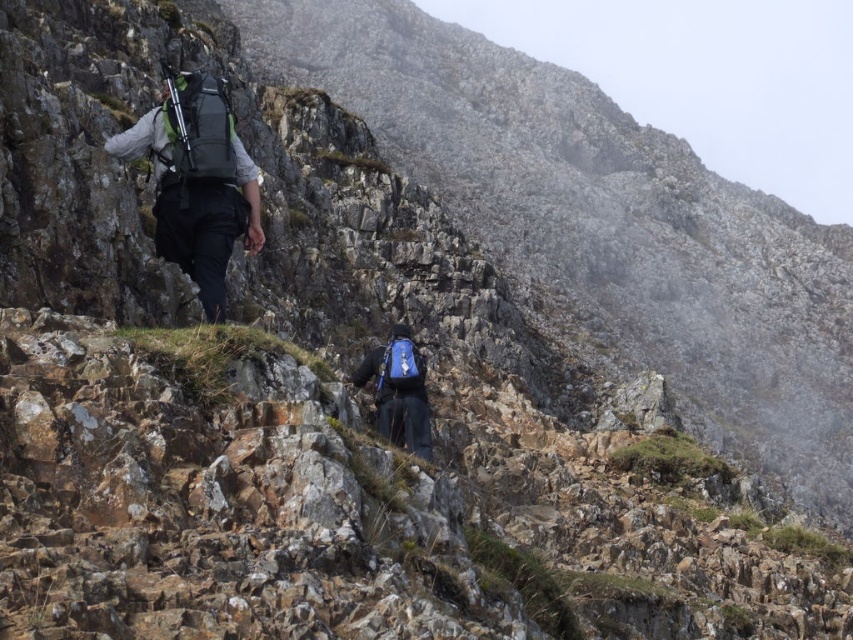
Is matte black backpack at left below blue fabric backpack at center?

Actually, matte black backpack at left is above blue fabric backpack at center.

Locate an element on the screen. This screenshot has height=640, width=853. matte black backpack at left is located at coordinates (196, 180).